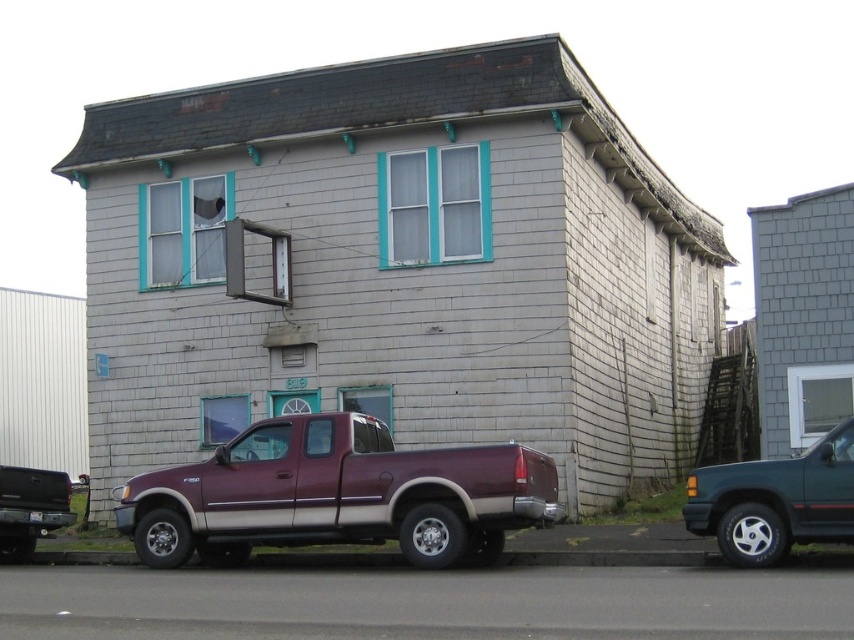
Question: Is metallic maroon truck at center to the left of maroon matte truck at center from the viewer's perspective?

Choices:
 (A) yes
 (B) no

Answer: (B)

Question: Among these objects, which one is farthest from the camera?

Choices:
 (A) maroon metallic truck at center
 (B) metallic maroon truck at center
 (C) maroon matte truck at center

Answer: (C)

Question: Can you confirm if maroon metallic truck at center is positioned below metallic maroon truck at center?

Choices:
 (A) no
 (B) yes

Answer: (B)

Question: Can you confirm if maroon metallic truck at center is positioned below metallic maroon truck at center?

Choices:
 (A) no
 (B) yes

Answer: (B)

Question: Which point is closer to the camera?

Choices:
 (A) maroon metallic truck at center
 (B) maroon matte truck at center

Answer: (A)

Question: Which point appears closest to the camera in this image?

Choices:
 (A) (33, 518)
 (B) (288, 532)
 (C) (720, 499)

Answer: (C)